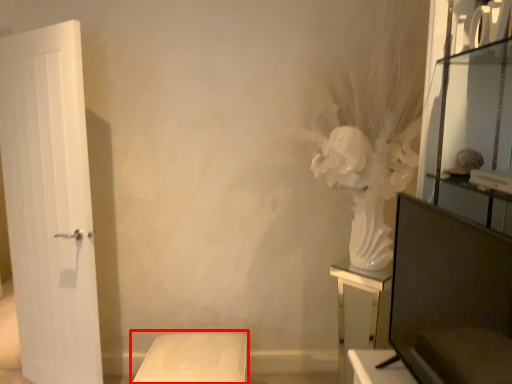
Question: From the image's perspective, considering the relative positions of furniture (annotated by the red box) and furniture in the image provided, where is furniture (annotated by the red box) located with respect to the staircase?

Choices:
 (A) above
 (B) below

Answer: (B)